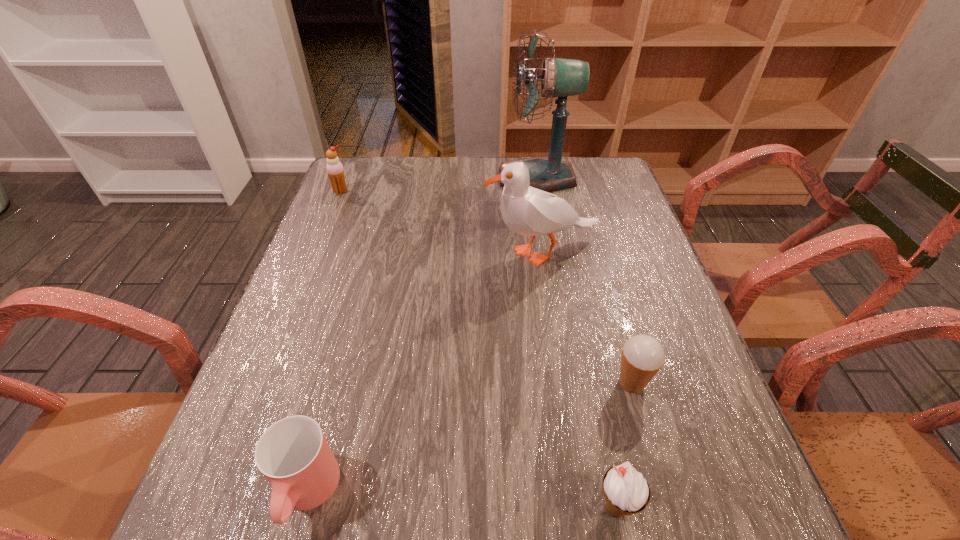
Where is `fan`? fan is located at coordinates (561, 78).

The image size is (960, 540). What are the coordinates of `the fifth shortest object` in the screenshot? It's located at (528, 211).

Find the location of a particular element. the third farthest object is located at coordinates (528, 211).

Where is `the leftmost icecream`? This screenshot has height=540, width=960. the leftmost icecream is located at coordinates (335, 171).

I want to click on the tallest icecream, so click(x=335, y=171).

Identify the location of the fourth farthest object. The height and width of the screenshot is (540, 960). (643, 356).

You are a GUI agent. You are given a task and a screenshot of the screen. Output one action in this format:
    pyautogui.click(x=<x>, y=<y>)
    Task: Click on the rightmost icecream
    
    Given the screenshot: What is the action you would take?
    pyautogui.click(x=643, y=356)

Where is `the nearest icecream`? This screenshot has width=960, height=540. the nearest icecream is located at coordinates (623, 486).

What are the coordinates of `free space located 0.330m in front of the tallest object where the wind blows` in the screenshot? It's located at (395, 178).

You are a GUI agent. You are given a task and a screenshot of the screen. Output one action in this format:
    pyautogui.click(x=<x>, y=<y>)
    Task: Click on the vacant space located 0.360m in front of the tallest object where the wind blows
    The height and width of the screenshot is (540, 960).
    Given the screenshot: What is the action you would take?
    pyautogui.click(x=385, y=178)